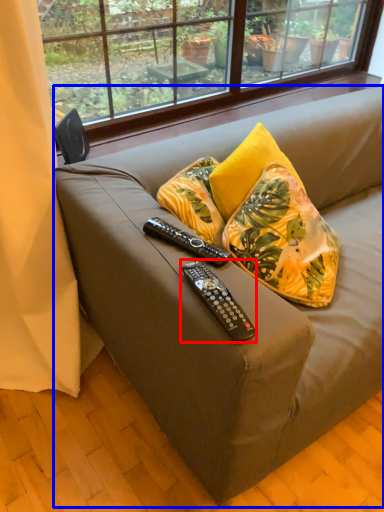
Question: Which object appears closest to the camera in this image, remote control (highlighted by a red box) or studio couch (highlighted by a blue box)?

Choices:
 (A) remote control
 (B) studio couch

Answer: (B)